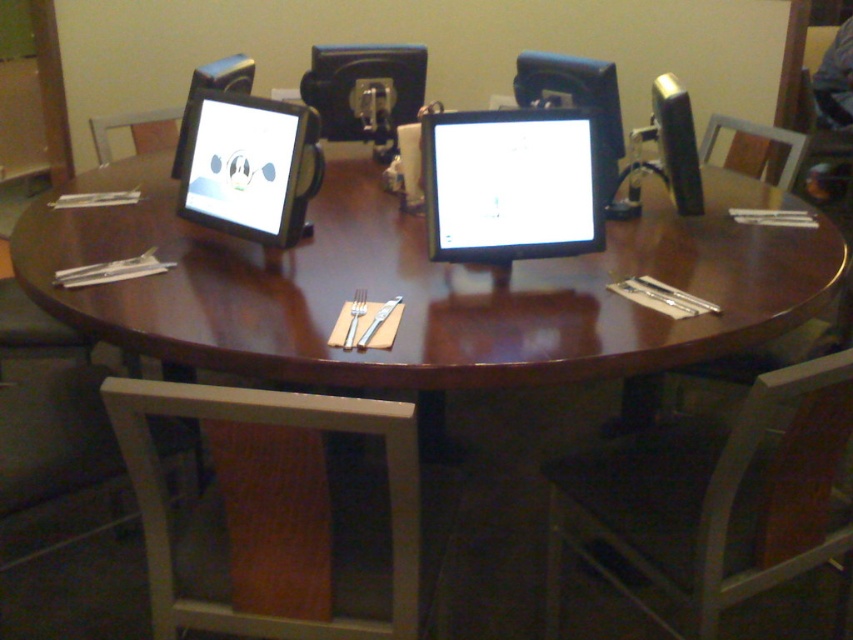
Is brown leather swivel chair at lower right shorter than wooden chair at upper left?

Incorrect, brown leather swivel chair at lower right's height does not fall short of wooden chair at upper left's.

Who is more forward, (x=738, y=572) or (x=146, y=125)?

Positioned in front is point (x=738, y=572).

What do you see at coordinates (712, 502) in the screenshot? This screenshot has width=853, height=640. I see `brown leather swivel chair at lower right` at bounding box center [712, 502].

Where is `brown leather swivel chair at lower right`? This screenshot has height=640, width=853. brown leather swivel chair at lower right is located at coordinates (712, 502).

Between brown leather swivel chair at lower right and white glossy monitor at center, which one has more height?

brown leather swivel chair at lower right

Between brown leather swivel chair at lower right and white glossy monitor at center, which one has less height?

white glossy monitor at center is shorter.

Measure the distance between brown leather swivel chair at lower right and camera.

brown leather swivel chair at lower right and camera are 1.18 meters apart from each other.

Locate an element on the screen. The width and height of the screenshot is (853, 640). brown leather swivel chair at lower right is located at coordinates point(712,502).

At what (x,y) coordinates should I click in order to perform the action: click on brown leather swivel chair at lower right. Please return your answer as a coordinate pair (x, y). The width and height of the screenshot is (853, 640). Looking at the image, I should click on (712, 502).

Does brown leather swivel chair at lower right appear over matte black monitor at center?

Actually, brown leather swivel chair at lower right is below matte black monitor at center.

Which is in front, point (598, 548) or point (238, 140)?

Point (238, 140) is more forward.

Locate an element on the screen. The height and width of the screenshot is (640, 853). brown leather swivel chair at lower right is located at coordinates (712, 502).